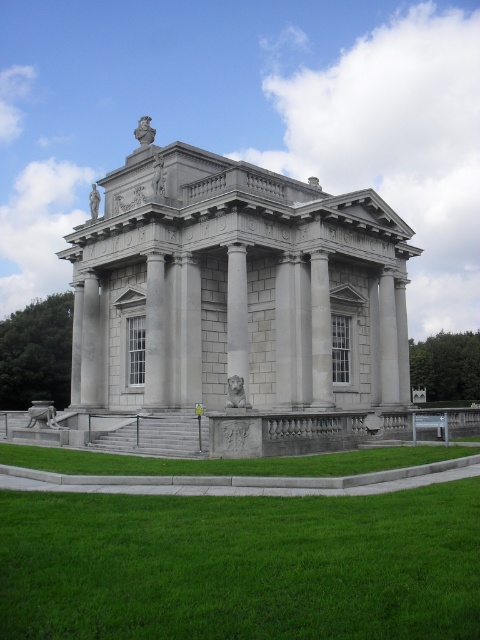
Is point (36, 458) positioned in front of point (229, 301)?

Yes.

Is green grass at lower center closer to camera compared to slate gray stone column at center?

Yes, green grass at lower center is in front of slate gray stone column at center.

Where is `green grass at lower center`? The width and height of the screenshot is (480, 640). green grass at lower center is located at coordinates (227, 461).